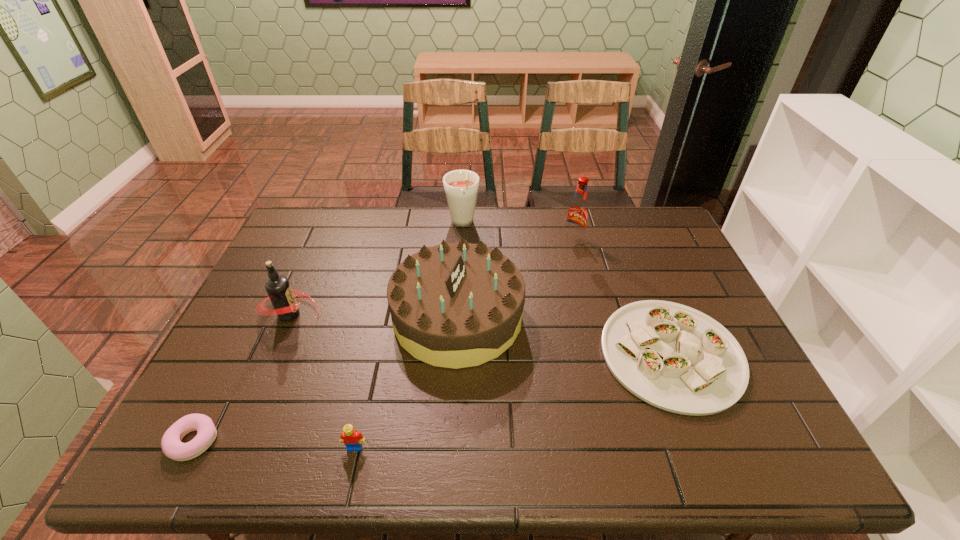
The image size is (960, 540). I want to click on free location located 0.330m on the label of the nearest root beer, so click(x=438, y=314).

Locate an element on the screen. Image resolution: width=960 pixels, height=540 pixels. vacant space situated 0.250m on the front-facing side of the birthday cake is located at coordinates (612, 318).

What are the coordinates of `vacant point located on the back of the sixth tallest object` in the screenshot? It's located at (634, 261).

Where is `vacant space located 0.070m on the back of the pastry`? Image resolution: width=960 pixels, height=540 pixels. vacant space located 0.070m on the back of the pastry is located at coordinates (218, 393).

This screenshot has height=540, width=960. In order to click on Lego at the near edge in this screenshot , I will do `click(351, 438)`.

At what (x,y) coordinates should I click in order to perform the action: click on pastry situated at the near edge. Please return your answer as a coordinate pair (x, y). The width and height of the screenshot is (960, 540). Looking at the image, I should click on (172, 447).

Locate an element on the screen. root beer at the left edge is located at coordinates (282, 296).

At what (x,y) coordinates should I click in order to perform the action: click on pastry that is at the left edge. Please return your answer as a coordinate pair (x, y). The width and height of the screenshot is (960, 540). Looking at the image, I should click on (172, 447).

Identify the location of object at the right edge. (676, 358).

Image resolution: width=960 pixels, height=540 pixels. In order to click on object that is at the near left corner in this screenshot , I will do `click(172, 447)`.